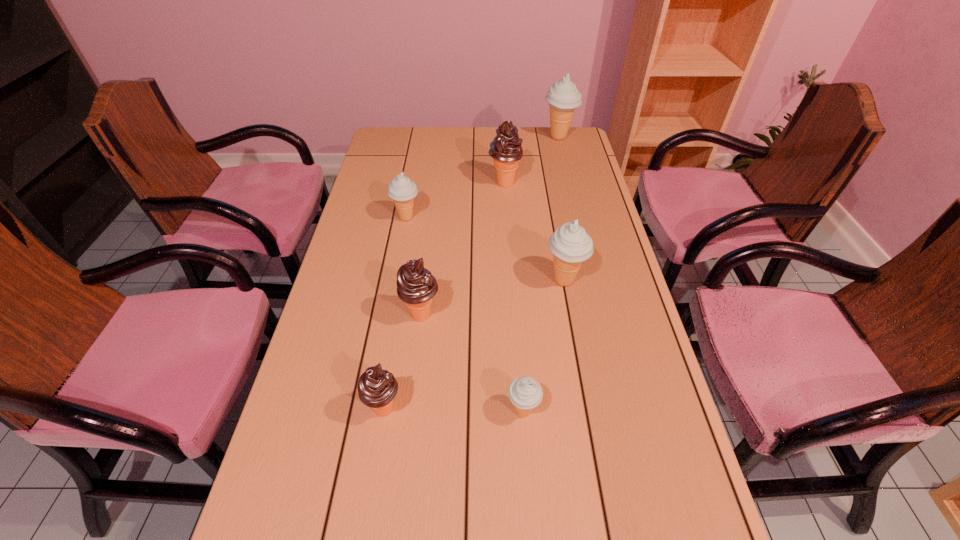
Image resolution: width=960 pixels, height=540 pixels. I want to click on the fifth nearest icecream, so click(x=401, y=189).

In order to click on the second beige icecream from left to right in this screenshot , I will do `click(525, 393)`.

Identify the location of the smallest beige icecream. The width and height of the screenshot is (960, 540). (525, 393).

Locate an element on the screen. The width and height of the screenshot is (960, 540). free space located 0.300m on the front of the farthest beige icecream is located at coordinates (571, 190).

At what (x,y) coordinates should I click in order to perform the action: click on free space located 0.050m on the right of the farthest chocolate icecream. Please return your answer as a coordinate pair (x, y). The width and height of the screenshot is (960, 540). Looking at the image, I should click on (535, 184).

The width and height of the screenshot is (960, 540). Find the location of `free space located 0.300m on the back of the third nearest object`. free space located 0.300m on the back of the third nearest object is located at coordinates (x=431, y=231).

Identify the location of free space located on the back of the third smallest beige icecream. (556, 237).

Find the location of `free point located 0.150m on the right of the smallest chocolate icecream`. free point located 0.150m on the right of the smallest chocolate icecream is located at coordinates (470, 409).

You are a GUI agent. You are given a task and a screenshot of the screen. Output one action in this format:
    pyautogui.click(x=<x>, y=<y>)
    Task: Click on the vacant point located on the front of the third farthest icecream
    
    Given the screenshot: What is the action you would take?
    pyautogui.click(x=399, y=260)

The height and width of the screenshot is (540, 960). Find the location of `free spot located 0.260m on the right of the shortest object`. free spot located 0.260m on the right of the shortest object is located at coordinates (658, 412).